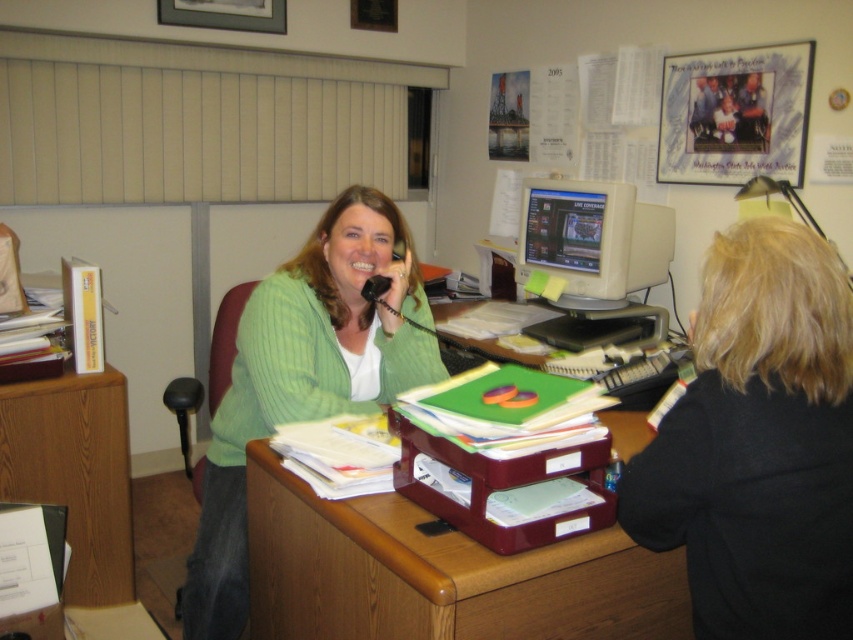
You are a GUI agent. You are given a task and a screenshot of the screen. Output one action in this format:
    pyautogui.click(x=<x>, y=<y>)
    Task: Click on the brown wood desk at center
    The height and width of the screenshot is (640, 853).
    Given the screenshot: What is the action you would take?
    pos(439,573)

Where is `brown wood desk at center`? brown wood desk at center is located at coordinates (439, 573).

Does white plastic monitor at center appear on the right side of black plastic microphone at upper center?

Yes, white plastic monitor at center is to the right of black plastic microphone at upper center.

Is white plastic monitor at center wider than black plastic microphone at upper center?

Correct, the width of white plastic monitor at center exceeds that of black plastic microphone at upper center.

Is point (656, 312) positioned in front of point (364, 284)?

No, (656, 312) is behind (364, 284).

Find the location of a particular element. The width and height of the screenshot is (853, 640). white plastic monitor at center is located at coordinates (595, 246).

Does wooden file cabinet at left have a greater height compared to white plastic monitor at center?

Indeed, wooden file cabinet at left has a greater height compared to white plastic monitor at center.

Is the position of wooden file cabinet at left more distant than that of white plastic monitor at center?

No, it is in front of white plastic monitor at center.

Find the location of `wooden file cabinet at left`. wooden file cabinet at left is located at coordinates pyautogui.click(x=74, y=474).

At what (x,y) coordinates should I click in order to perform the action: click on wooden file cabinet at left. Please return your answer as a coordinate pair (x, y). This screenshot has height=640, width=853. Looking at the image, I should click on (74, 474).